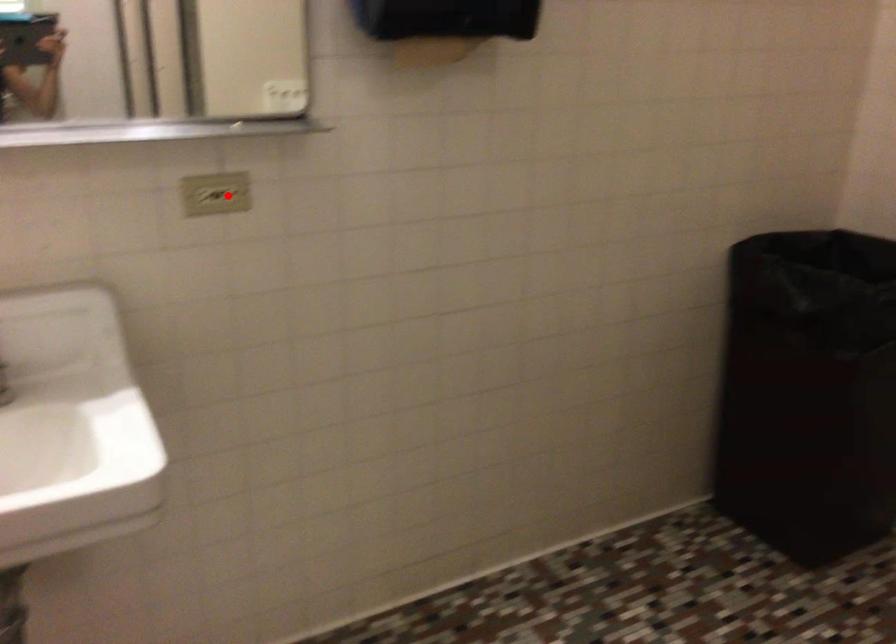
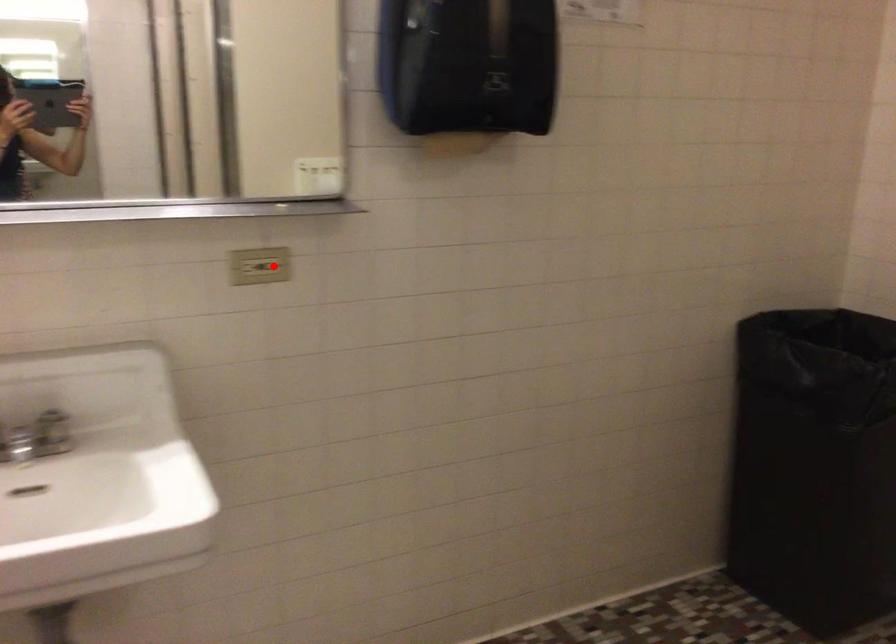
Looking at this image, I am providing you with two images of the same scene from different viewpoints. A red point is marked on the first image and another point is marked on the second image. Is the red point in image1 aligned with the point shown in image2?

Yes